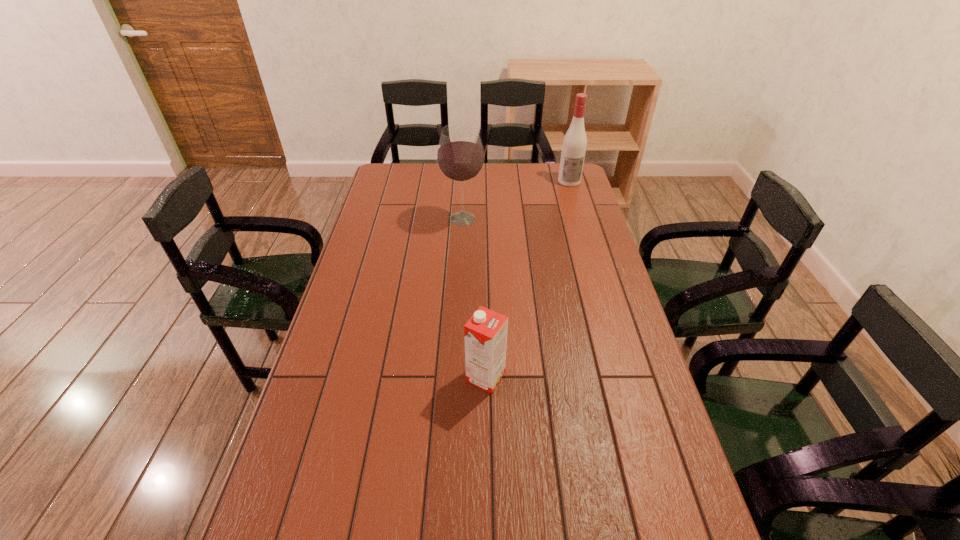
This screenshot has width=960, height=540. I want to click on object positioned at the right edge, so click(x=574, y=145).

Where is `object at the far right corner`? This screenshot has width=960, height=540. object at the far right corner is located at coordinates (574, 145).

The width and height of the screenshot is (960, 540). In order to click on free space at the far edge of the desktop in this screenshot , I will do `click(421, 170)`.

This screenshot has width=960, height=540. What are the coordinates of `vacant region at the left edge of the desktop` in the screenshot? It's located at (365, 228).

Locate an element on the screen. The image size is (960, 540). free space at the right edge is located at coordinates (557, 199).

Where is `free location at the far left corner`? Image resolution: width=960 pixels, height=540 pixels. free location at the far left corner is located at coordinates (411, 167).

Where is `blank region between the right alcohol and the left alcohol`? The image size is (960, 540). blank region between the right alcohol and the left alcohol is located at coordinates (516, 200).

Identify the location of empty location between the nearer alcohol and the rightmost object. The image size is (960, 540). [516, 200].

What are the coordinates of `vacant point located between the left alcohol and the right alcohol` in the screenshot? It's located at (516, 200).

At what (x,y) coordinates should I click in order to perform the action: click on empty space that is in between the carton and the rightmost object. Please return your answer as a coordinate pair (x, y). The image size is (960, 540). Looking at the image, I should click on (527, 279).